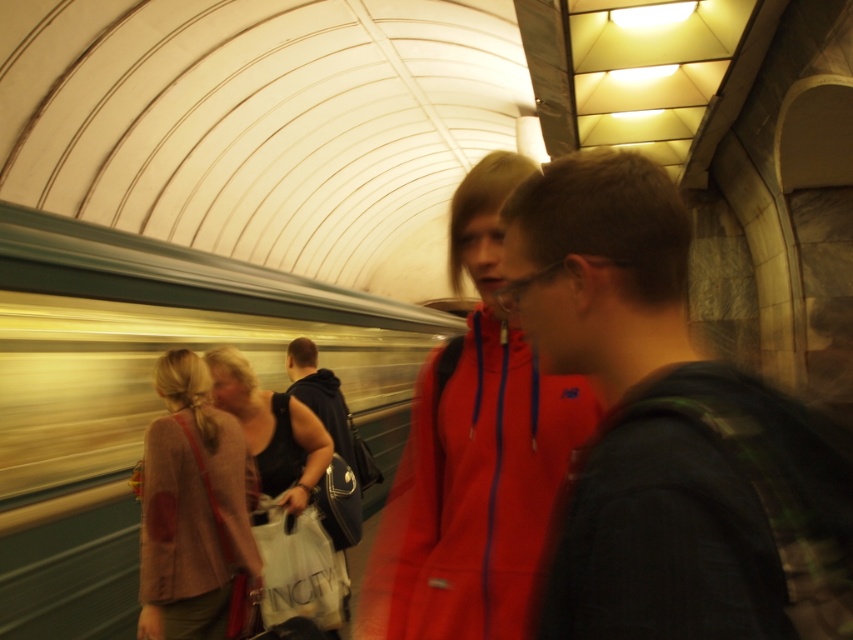
Based on the photo, can you confirm if light brown fabric jacket at lower left is thinner than dark gray fabric backpack at center?

Indeed, light brown fabric jacket at lower left has a lesser width compared to dark gray fabric backpack at center.

Between light brown fabric jacket at lower left and dark gray fabric backpack at center, which one has more height?

light brown fabric jacket at lower left

At what (x,y) coordinates should I click in order to perform the action: click on light brown fabric jacket at lower left. Please return your answer as a coordinate pair (x, y). Looking at the image, I should click on (195, 513).

What are the coordinates of `light brown fabric jacket at lower left` in the screenshot? It's located at (195, 513).

Does matte red jacket at center appear on the right side of dark gray fabric backpack at center?

Yes, matte red jacket at center is to the right of dark gray fabric backpack at center.

Between matte red jacket at center and dark gray fabric backpack at center, which one is positioned lower?

dark gray fabric backpack at center is lower down.

Where is `matte red jacket at center`? matte red jacket at center is located at coordinates (474, 454).

Between point (236, 470) and point (271, 454), which one is positioned behind?

The point (271, 454) is behind.

You are a GUI agent. You are given a task and a screenshot of the screen. Output one action in this format:
    pyautogui.click(x=<x>, y=<y>)
    Task: Click on the light brown fabric jacket at lower left
    This screenshot has height=640, width=853.
    Given the screenshot: What is the action you would take?
    pyautogui.click(x=195, y=513)